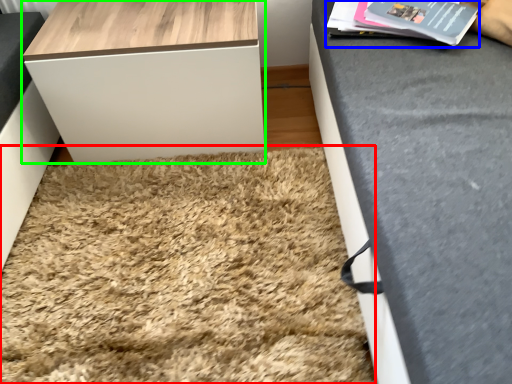
Question: Considering the real-world distances, which object is closest to mat (highlighted by a red box)? magazine (highlighted by a blue box) or table (highlighted by a green box).

Choices:
 (A) magazine
 (B) table

Answer: (B)